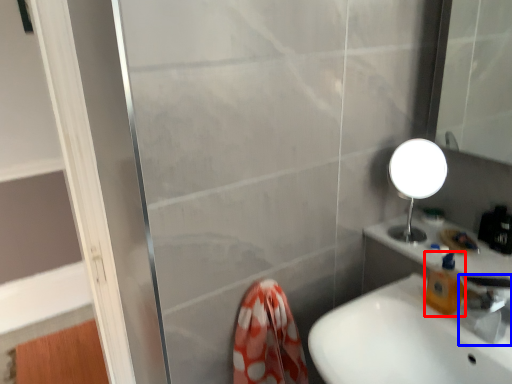
Question: Which of the following is the closest to the observer, soap dispenser (highlighted by a red box) or tap (highlighted by a blue box)?

Choices:
 (A) soap dispenser
 (B) tap

Answer: (B)